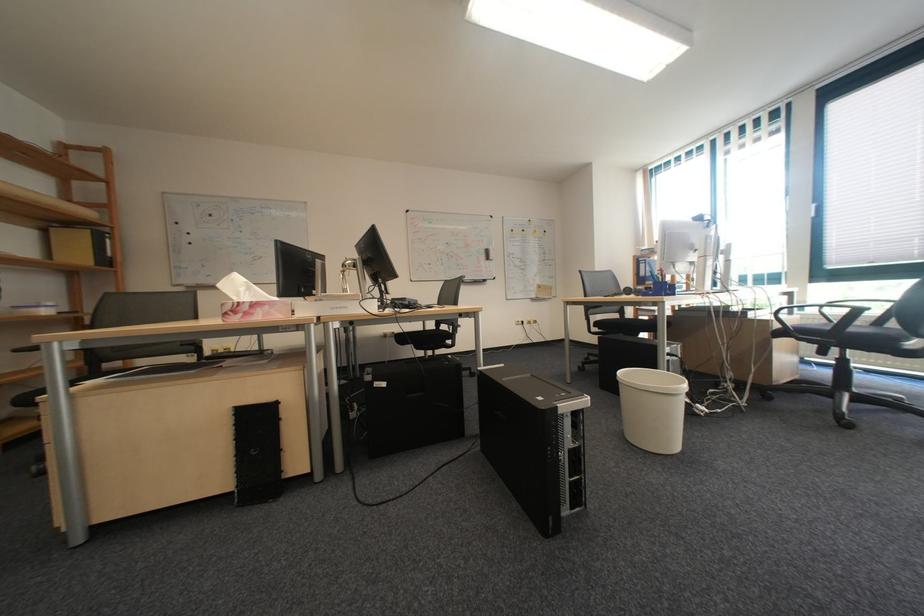
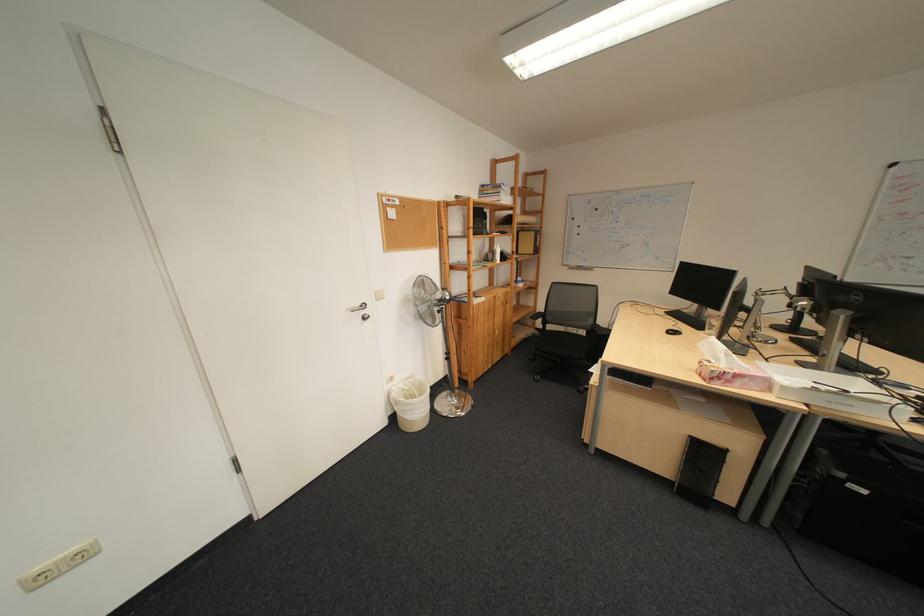
Locate, in the second image, the point that corresponds to [334,318] in the first image.

(821, 407)